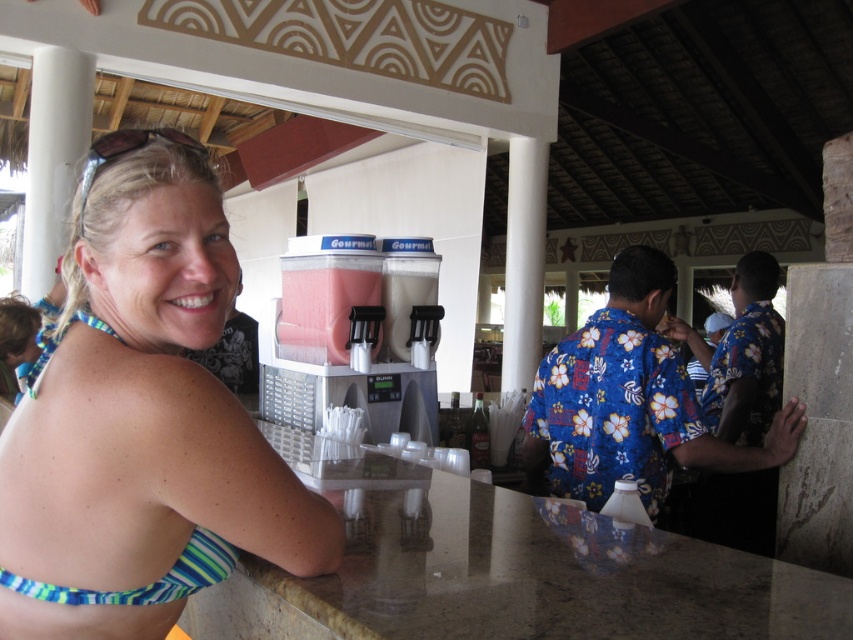
You are a customer at the tropical bar and want to know which clothing item is narrower between the blue striped bikini top at left and the blue floral shirt at center. Can you tell me?

The blue striped bikini top at left is narrower than the blue floral shirt at center.